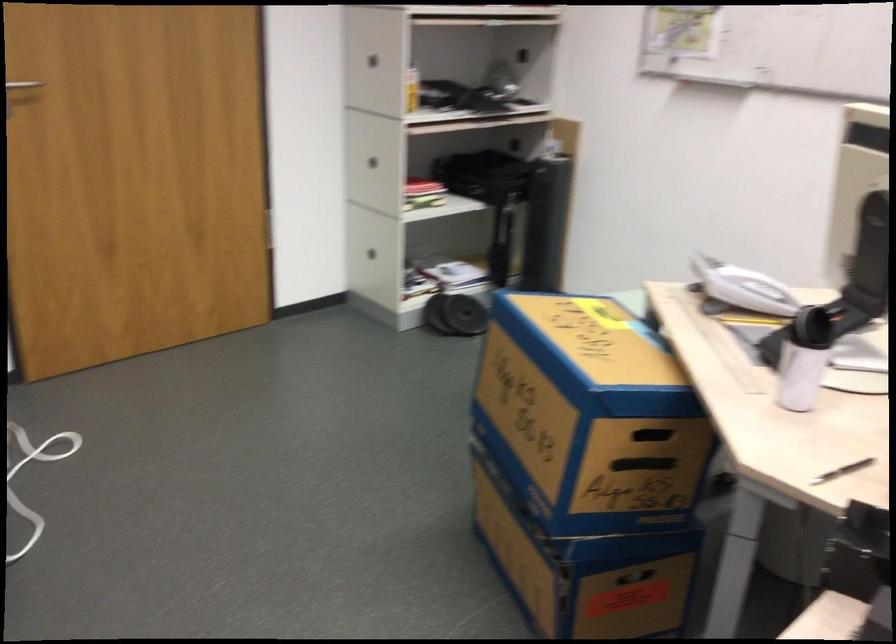
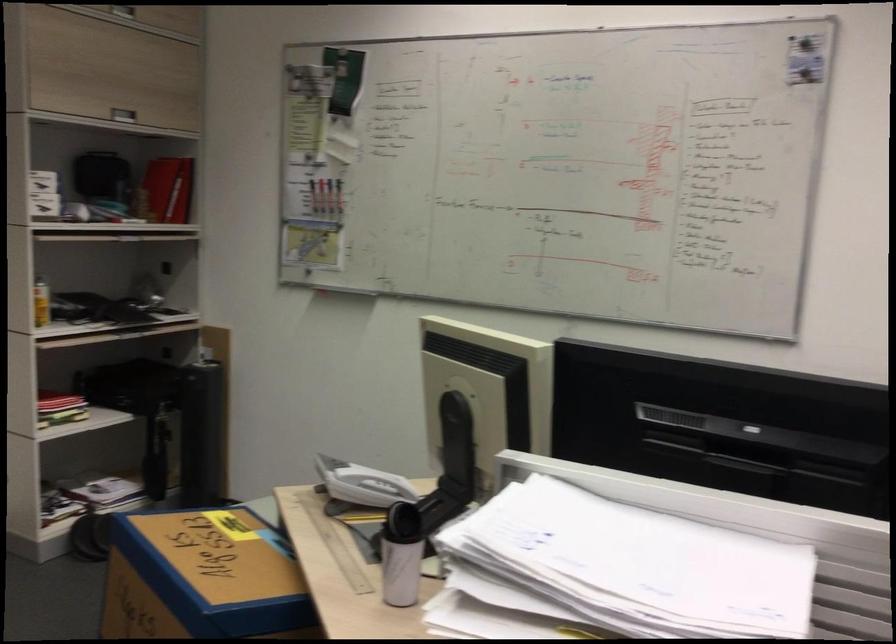
Find the pixel in the second image that matches pixel 506 242 in the first image.

(169, 451)